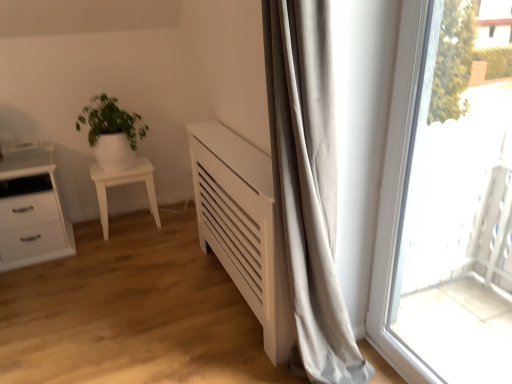
Question: Can you confirm if transparent glass window at right is smaller than white glossy chest of drawers at left?

Choices:
 (A) yes
 (B) no

Answer: (A)

Question: Is transparent glass window at right far from white glossy chest of drawers at left?

Choices:
 (A) yes
 (B) no

Answer: (A)

Question: From a real-world perspective, is transparent glass window at right located beneath white glossy chest of drawers at left?

Choices:
 (A) yes
 (B) no

Answer: (B)

Question: Is transparent glass window at right in front of white glossy chest of drawers at left?

Choices:
 (A) yes
 (B) no

Answer: (A)

Question: From the image's perspective, is transparent glass window at right below white glossy chest of drawers at left?

Choices:
 (A) no
 (B) yes

Answer: (B)

Question: Do you think white glossy side table at left is within white glossy pot at left, or outside of it?

Choices:
 (A) inside
 (B) outside

Answer: (B)

Question: Looking at their shapes, would you say white glossy side table at left is wider or thinner than white glossy pot at left?

Choices:
 (A) thin
 (B) wide

Answer: (A)

Question: In the image, is white glossy side table at left positioned in front of or behind white glossy pot at left?

Choices:
 (A) behind
 (B) front

Answer: (A)

Question: Does point (132, 177) appear closer or farther from the camera than point (105, 109)?

Choices:
 (A) farther
 (B) closer

Answer: (A)

Question: Based on their sizes in the image, would you say white glossy pot at left is bigger or smaller than white glossy chest of drawers at left?

Choices:
 (A) small
 (B) big

Answer: (A)

Question: Is point (89, 129) closer or farther from the camera than point (33, 213)?

Choices:
 (A) farther
 (B) closer

Answer: (A)

Question: Looking at their shapes, would you say white glossy pot at left is wider or thinner than white glossy chest of drawers at left?

Choices:
 (A) thin
 (B) wide

Answer: (A)

Question: Do you think white glossy pot at left is within white glossy chest of drawers at left, or outside of it?

Choices:
 (A) inside
 (B) outside

Answer: (B)

Question: In terms of height, does transparent glass window at right look taller or shorter compared to white glossy pot at left?

Choices:
 (A) tall
 (B) short

Answer: (A)

Question: Is transparent glass window at right in front of or behind white glossy pot at left in the image?

Choices:
 (A) front
 (B) behind

Answer: (A)